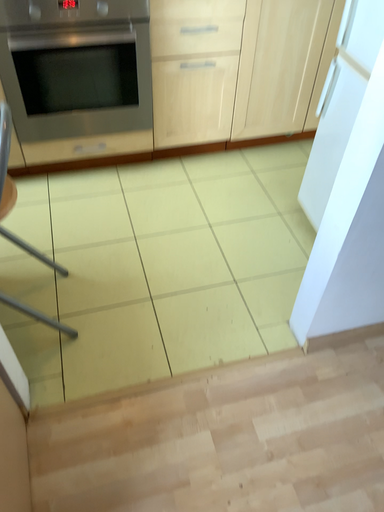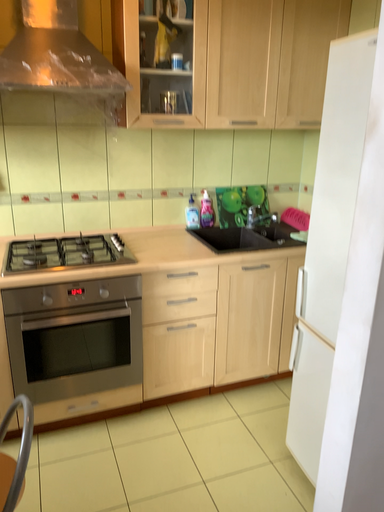
Question: Which way did the camera rotate in the video?

Choices:
 (A) rotated downward
 (B) rotated upward

Answer: (B)